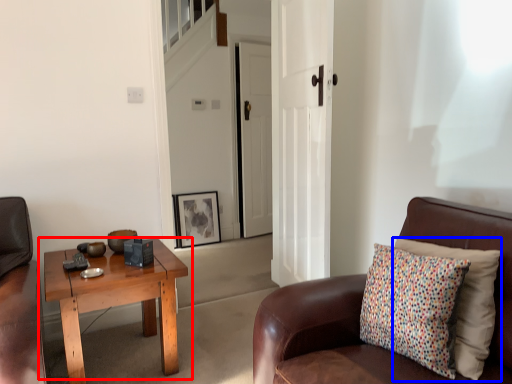
Question: Among these objects, which one is farthest to the camera, coffee table (highlighted by a red box) or pillow (highlighted by a blue box)?

Choices:
 (A) coffee table
 (B) pillow

Answer: (A)